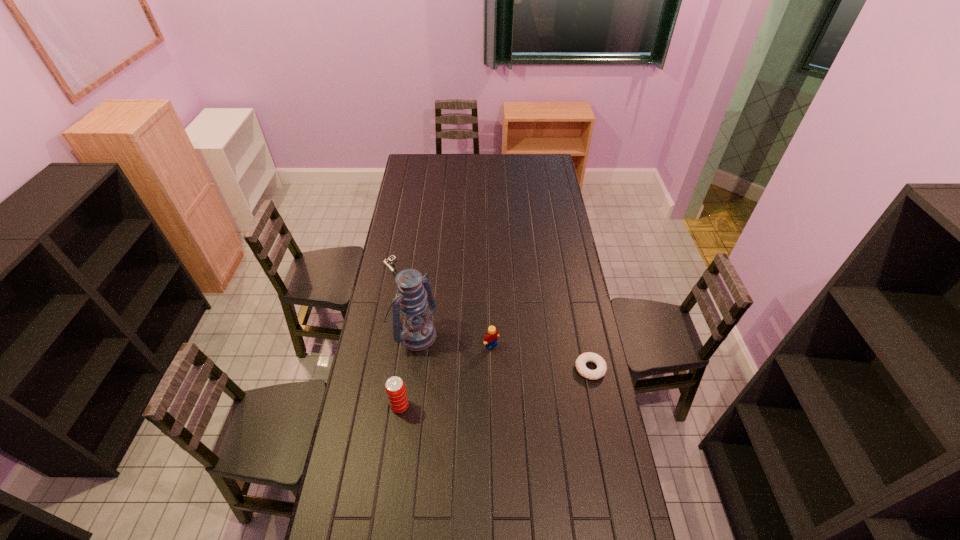
I want to click on vacant space that is in between the third tallest object and the lantern, so click(452, 339).

Locate an element on the screen. Image resolution: width=960 pixels, height=540 pixels. vacant region between the pistol and the second nearest object is located at coordinates (492, 319).

Find the location of a particular element. vacant area that lies between the Lego and the doughnut is located at coordinates (540, 357).

Locate an element on the screen. The height and width of the screenshot is (540, 960). unoccupied area between the tallest object and the Lego is located at coordinates (452, 339).

Locate an element on the screen. This screenshot has height=540, width=960. vacant region between the tallest object and the nearest object is located at coordinates (407, 369).

Find the location of a particular element. object that is the fourth closest to the tallest object is located at coordinates (581, 361).

Select which object appears as the fourth closest to the fourth shortest object. Please provide its 2D coordinates. Your answer should be formatted as a tuple, i.e. [(x, y)], where the tuple contains the x and y coordinates of a point satisfying the conditions above.

[(581, 361)]

Locate an element on the screen. This screenshot has height=540, width=960. free space in the image that satisfies the following two spatial constraints: 1. on the front side of the Lego; 2. on the right side of the tallest object is located at coordinates (412, 346).

The width and height of the screenshot is (960, 540). Identify the location of free point that satisfies the following two spatial constraints: 1. on the back side of the nearest object; 2. on the left side of the Lego. 408,346.